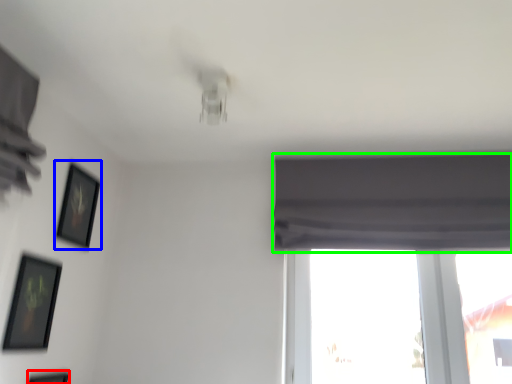
Question: Considering the real-world distances, which object is farthest from picture frame (highlighted by a red box)? picture frame (highlighted by a blue box) or curtain (highlighted by a green box)?

Choices:
 (A) picture frame
 (B) curtain

Answer: (B)